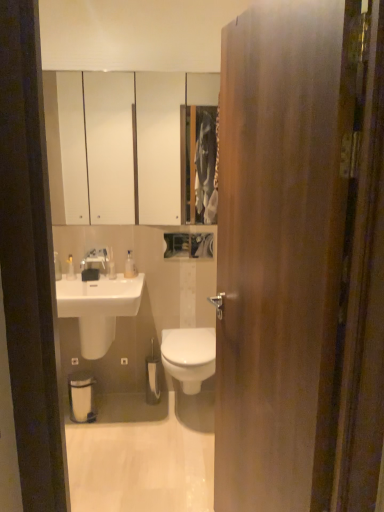
Find the location of a particular element. This screenshot has width=384, height=512. vacant space in white glossy bidet at center (from a real-world perspective) is located at coordinates (190, 414).